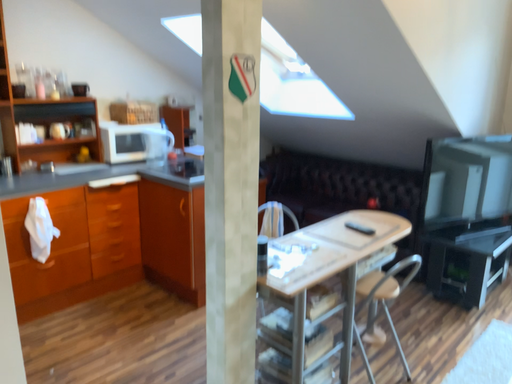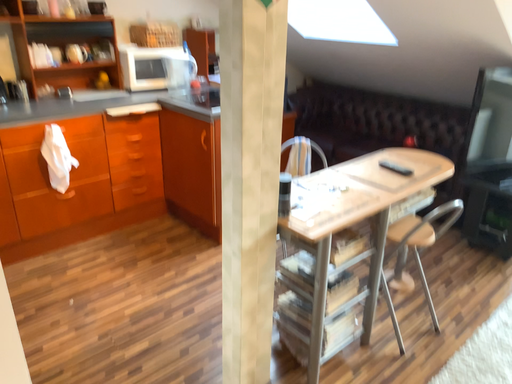
Question: How did the camera likely rotate when shooting the video?

Choices:
 (A) rotated downward
 (B) rotated upward

Answer: (A)